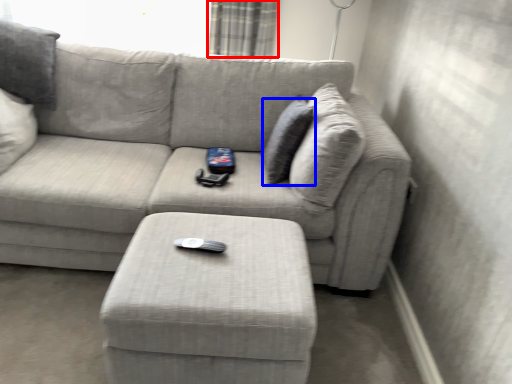
Question: Which of the following is the closest to the observer, curtain (highlighted by a red box) or pillow (highlighted by a blue box)?

Choices:
 (A) curtain
 (B) pillow

Answer: (B)